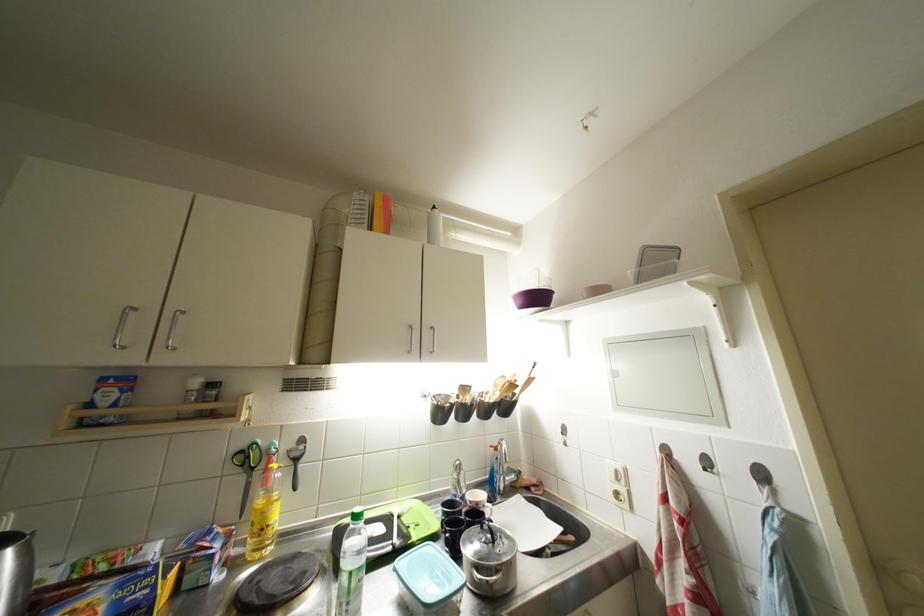
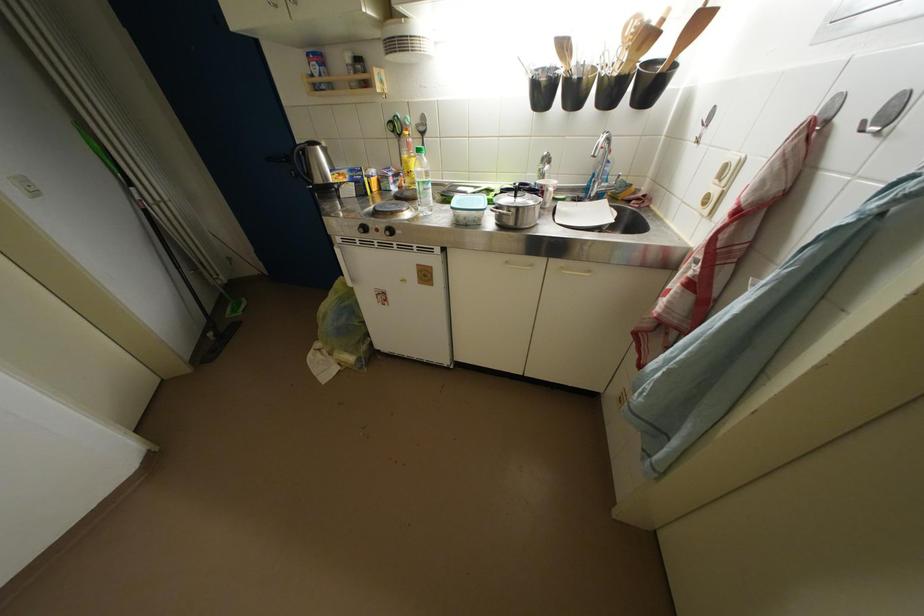
The point at (500, 546) is marked in the first image. Where is the corresponding point in the second image?

(523, 200)